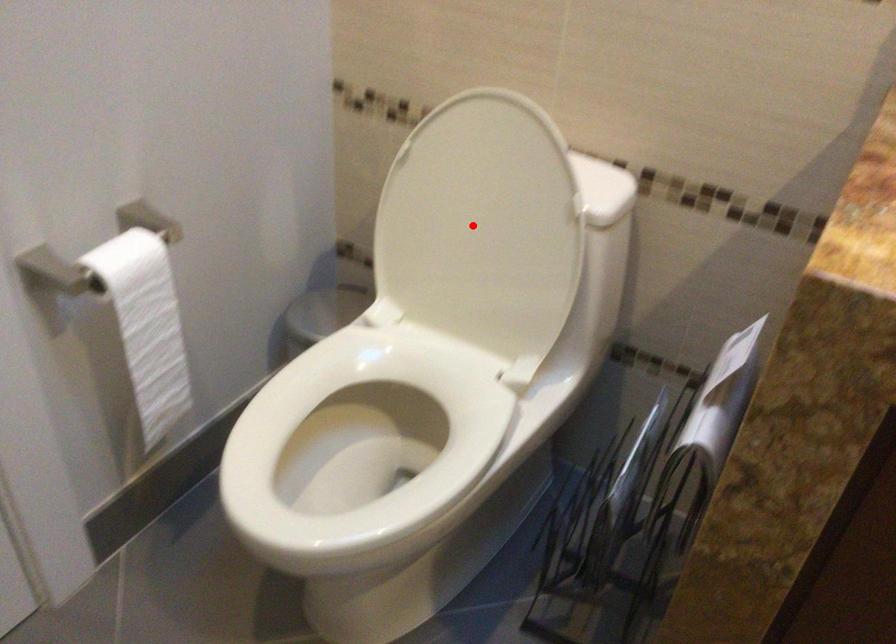
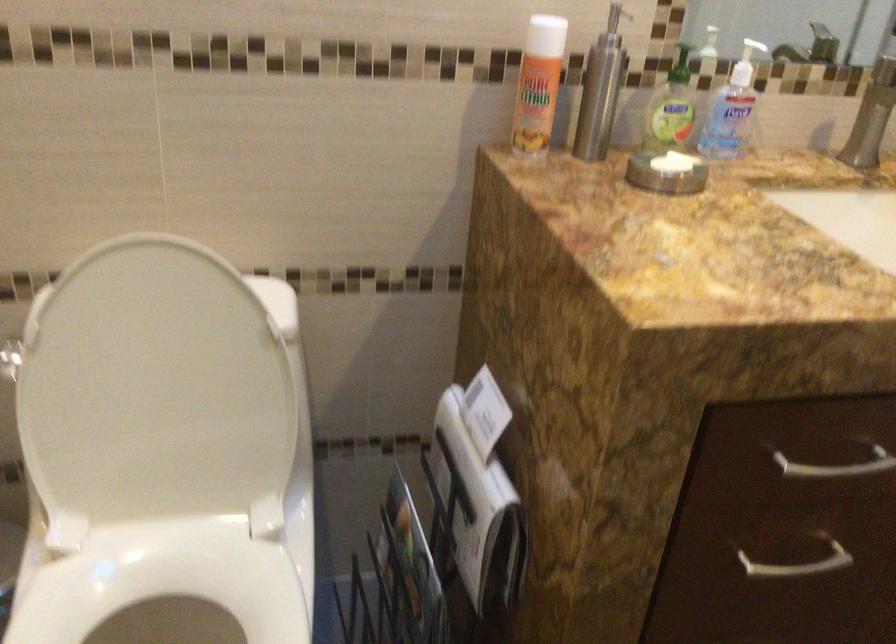
The point at the highlighted location is marked in the first image. Where is the corresponding point in the second image?

(152, 391)